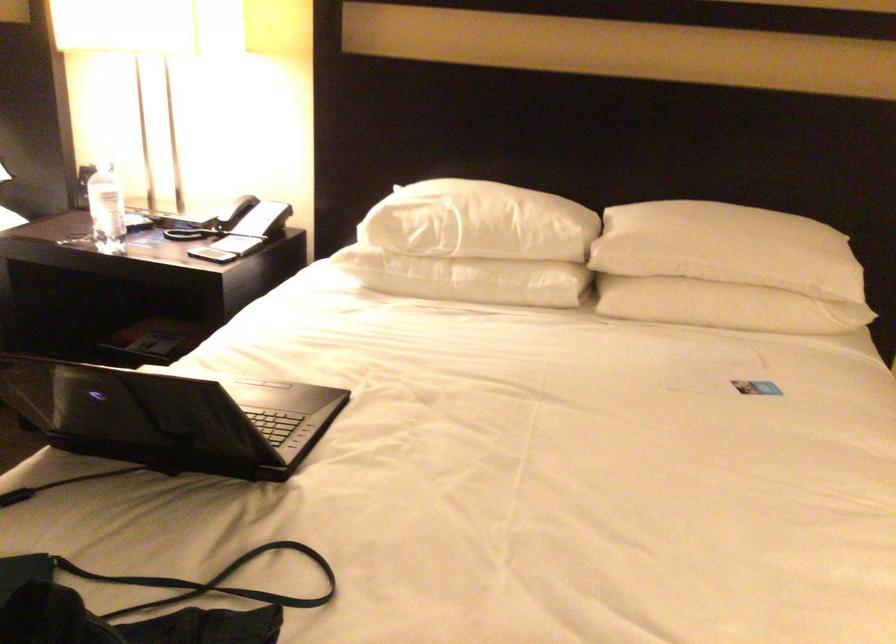
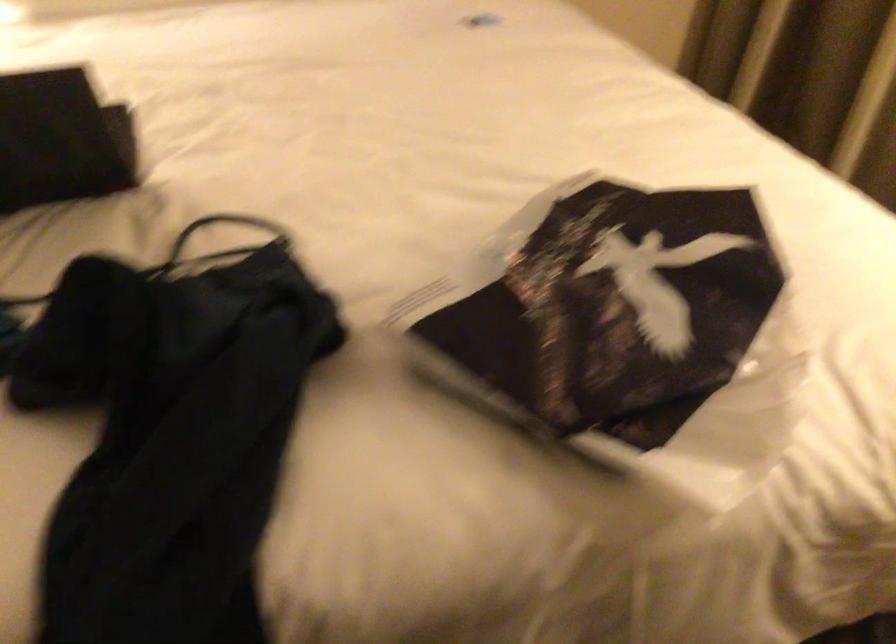
First-person continuous shooting, in which direction is the camera rotating?

The rotation direction of the camera is right-down.